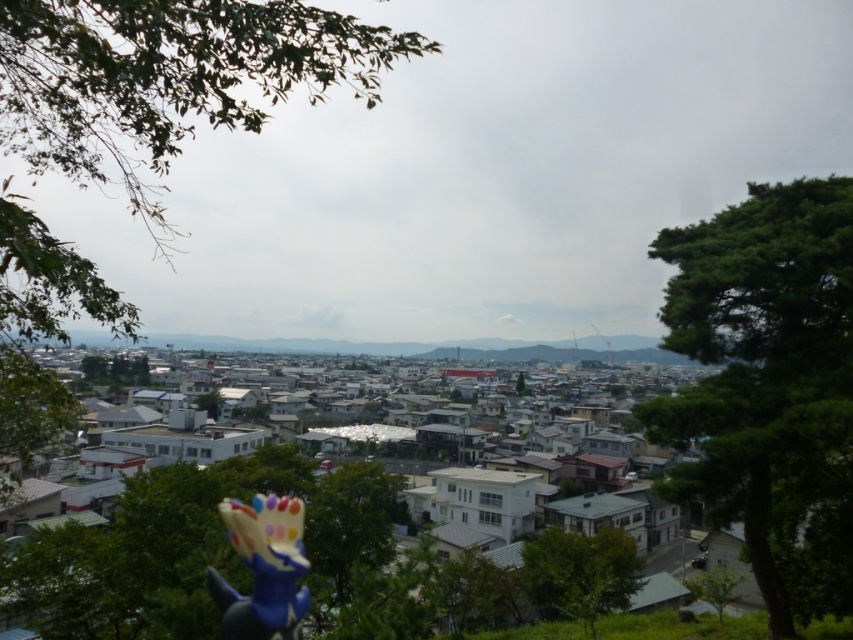
Is blue rubber glove at lower center positioned behind green leafy tree at lower center?

No.

Describe the element at coordinates (263, 568) in the screenshot. The image size is (853, 640). I see `blue rubber glove at lower center` at that location.

The height and width of the screenshot is (640, 853). Identify the location of blue rubber glove at lower center. (263, 568).

You are a GUI agent. You are given a task and a screenshot of the screen. Output one action in this format:
    pyautogui.click(x=<x>, y=<y>)
    Task: Click on the blue rubber glove at lower center
    The width and height of the screenshot is (853, 640).
    Given the screenshot: What is the action you would take?
    pyautogui.click(x=263, y=568)

Does green leafy tree at upper left have a greater width compared to green leafy tree at center?

Correct, the width of green leafy tree at upper left exceeds that of green leafy tree at center.

Is green leafy tree at upper left in front of green leafy tree at center?

That is True.

Describe the element at coordinates (166, 77) in the screenshot. I see `green leafy tree at upper left` at that location.

The image size is (853, 640). Find the location of `green leafy tree at upper left`. green leafy tree at upper left is located at coordinates (166, 77).

Between point (695, 588) and point (102, 376), which one is positioned in front?

Positioned in front is point (695, 588).

Does green leafy tree at lower right appear under green leafy tree at center?

No.

Where is `green leafy tree at lower right`? Image resolution: width=853 pixels, height=640 pixels. green leafy tree at lower right is located at coordinates coord(715,588).

Identify the location of green leafy tree at lower right. Image resolution: width=853 pixels, height=640 pixels. (715, 588).